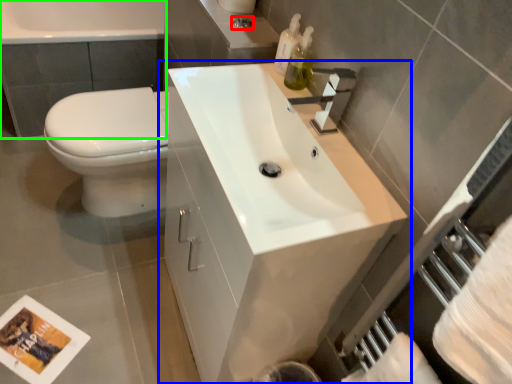
Question: Which is nearer to the plumbing fixture (highlighted by a red box)? bathroom cabinet (highlighted by a blue box) or bath (highlighted by a green box).

Choices:
 (A) bathroom cabinet
 (B) bath

Answer: (A)